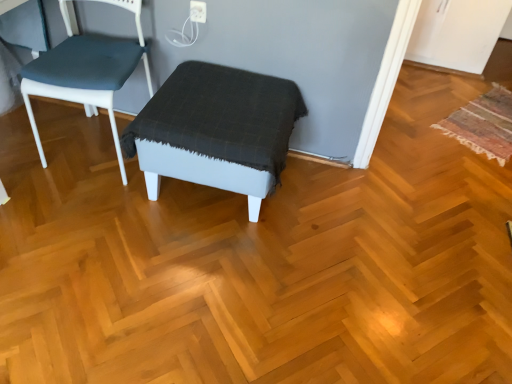
You are a GUI agent. You are given a task and a screenshot of the screen. Output one action in this format:
    pyautogui.click(x=<x>, y=<y>)
    Task: Click on the free space in front of matte blue fabric chair at left
    The image size is (512, 384).
    Given the screenshot: What is the action you would take?
    78,213